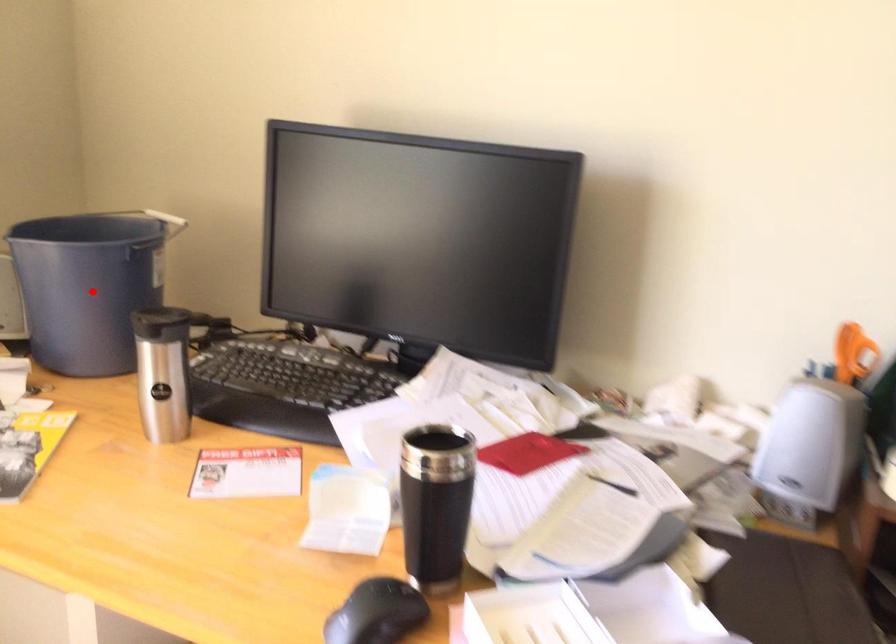
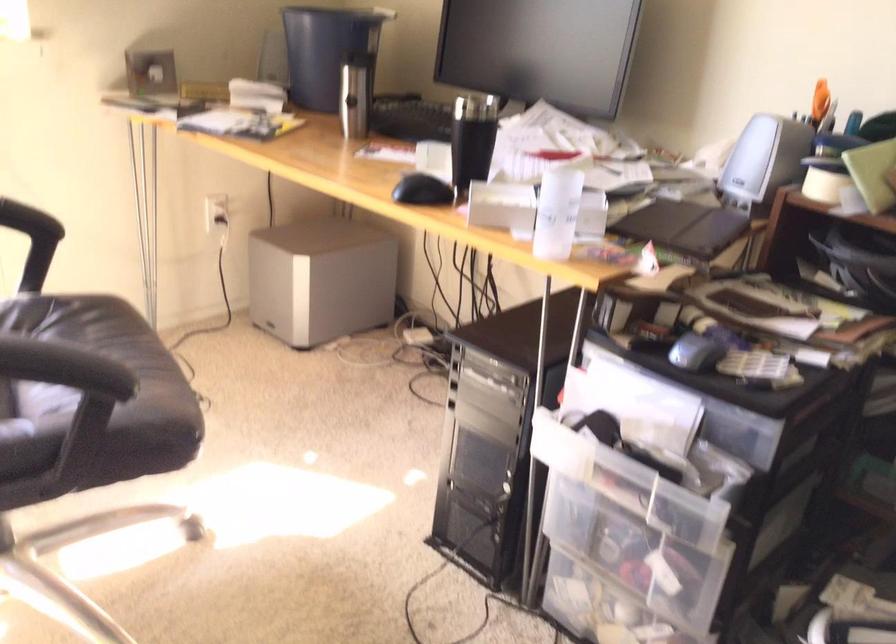
Question: I am providing you with two images of the same scene from different viewpoints. Image1 has a red point marked. In image2, the corresponding 3D location appears at what relative position? Reply with the corresponding letter.

Choices:
 (A) Closer
 (B) Farther

Answer: (B)